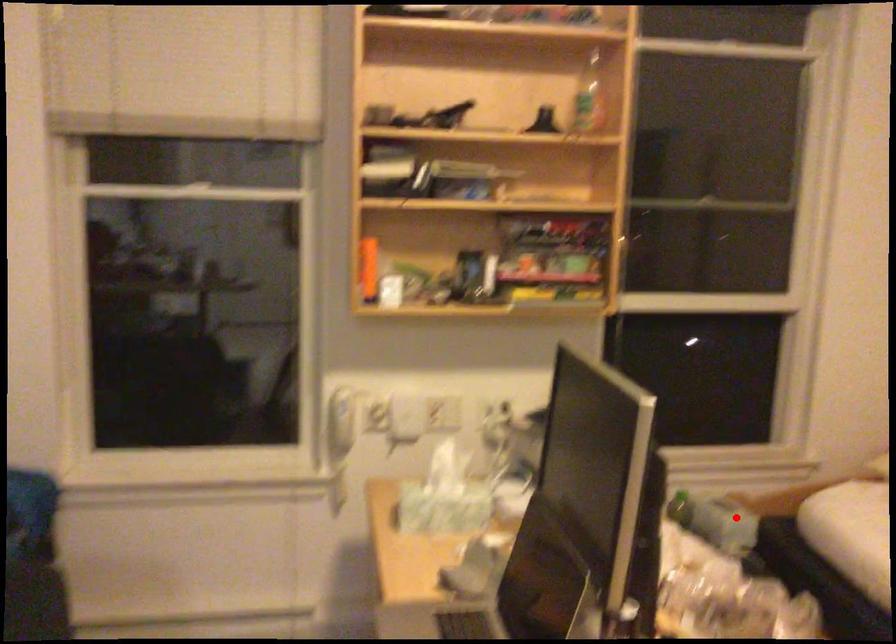
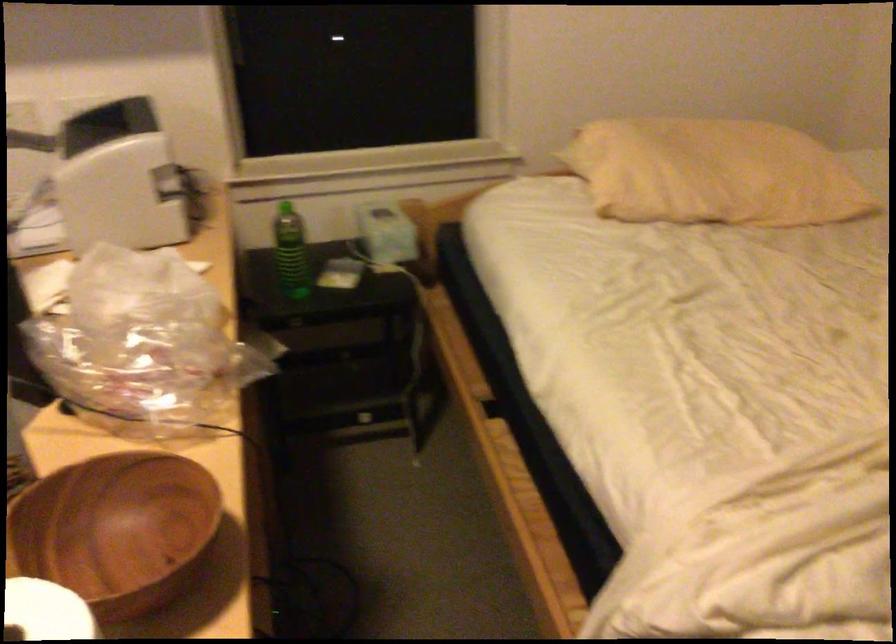
Where in the second image is the point corresponding to the highlighted location from the first image?

(385, 232)